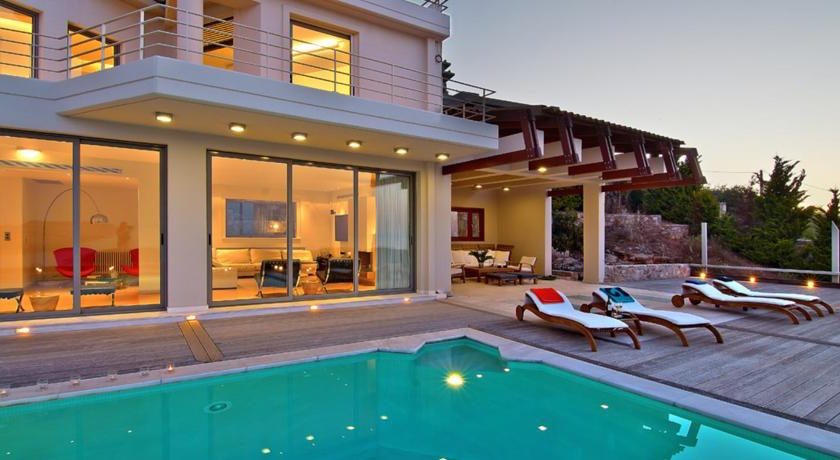
Find the location of a particular element. The height and width of the screenshot is (460, 840). floor is located at coordinates [x=738, y=353].